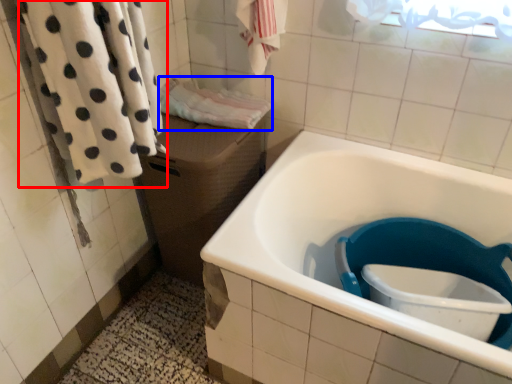
Question: Among these objects, which one is nearest to the camera, bath towel (highlighted by a red box) or bath towel (highlighted by a blue box)?

Choices:
 (A) bath towel
 (B) bath towel

Answer: (A)